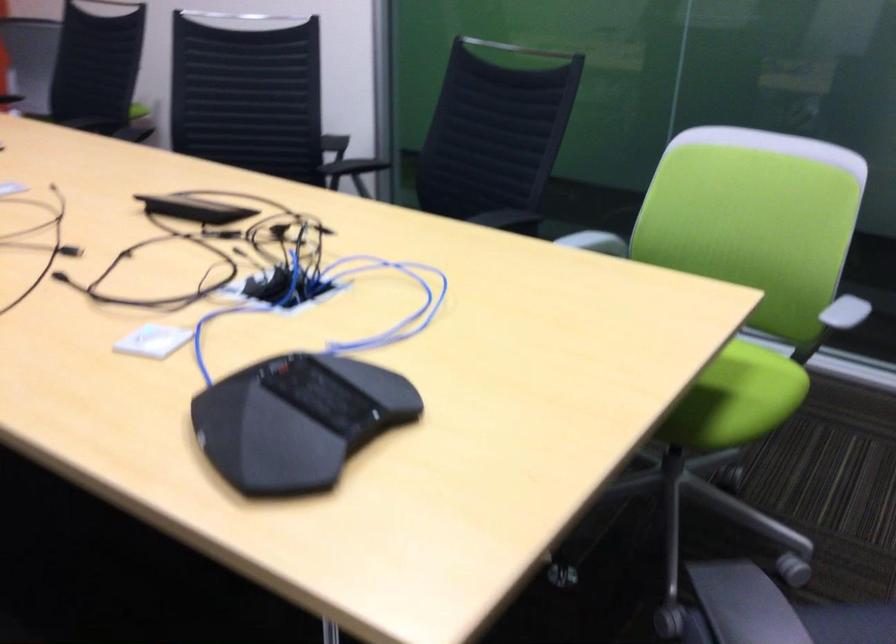
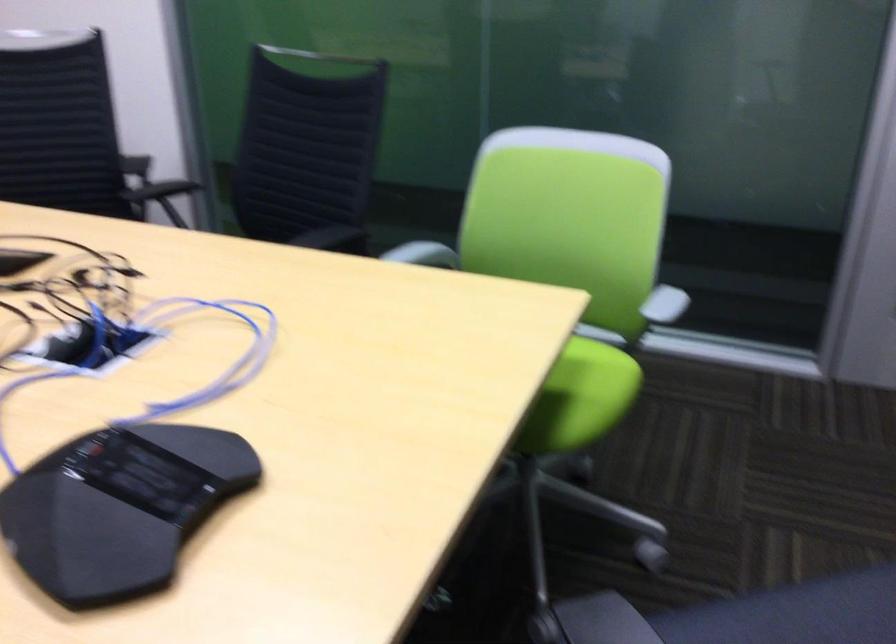
Where in the second image is the point corresponding to point 753,397 from the first image?

(590, 392)